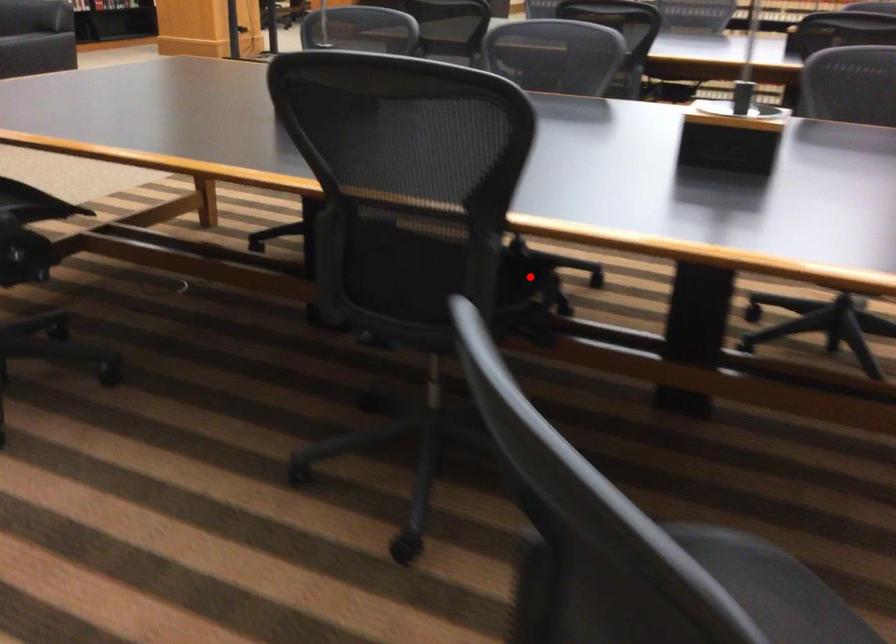
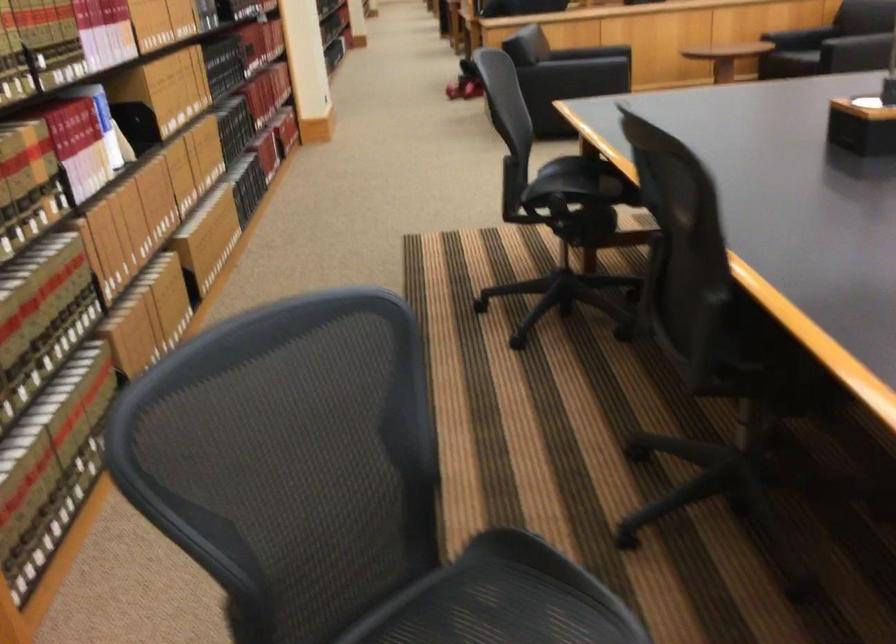
Question: I am providing you with two images of the same scene from different viewpoints. A red point is marked on the first image. Can you still see the location of the red point in image 2?

Choices:
 (A) Yes
 (B) No

Answer: (B)